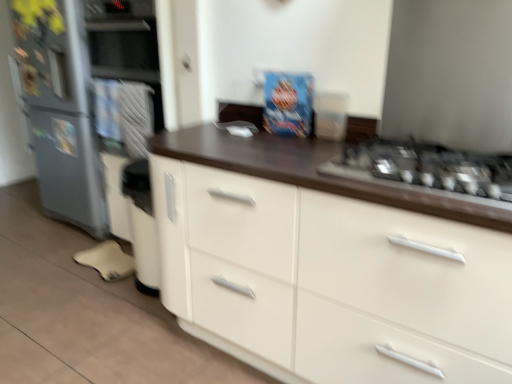
Question: Considering the positions of metallic silver gas stove at right and metallic gray refrigerator at left in the image, is metallic silver gas stove at right taller or shorter than metallic gray refrigerator at left?

Choices:
 (A) short
 (B) tall

Answer: (A)

Question: From a real-world perspective, is metallic silver gas stove at right physically located above or below metallic gray refrigerator at left?

Choices:
 (A) below
 (B) above

Answer: (B)

Question: Estimate the real-world distances between objects in this image. Which object is farther from the white glossy cabinet at center?

Choices:
 (A) metallic silver gas stove at right
 (B) metallic gray refrigerator at left

Answer: (B)

Question: Which object is the closest to the metallic silver gas stove at right?

Choices:
 (A) white glossy cabinet at center
 (B) metallic gray refrigerator at left

Answer: (A)